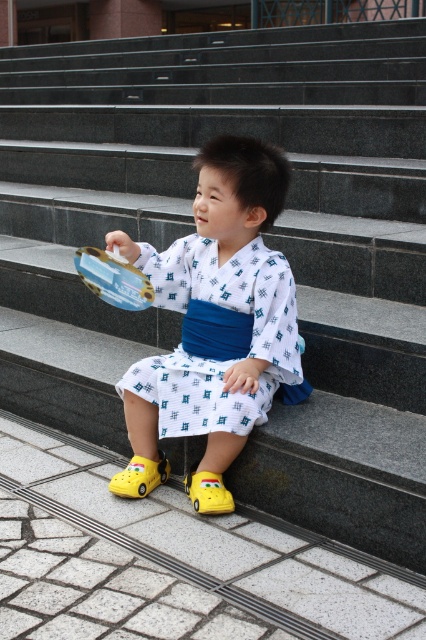
Question: Which of these objects is positioned closest to the metallic plastic toy car at center?

Choices:
 (A) yellow rubber shoe at lower left
 (B) white printed kimono at center
 (C) yellow rubber shoe at lower center

Answer: (B)

Question: Does white printed kimono at center have a larger size compared to metallic plastic toy car at center?

Choices:
 (A) no
 (B) yes

Answer: (B)

Question: Based on their relative distances, which object is farther from the yellow rubber shoe at lower center?

Choices:
 (A) white printed kimono at center
 (B) yellow rubber shoe at lower left
 (C) metallic plastic toy car at center

Answer: (C)

Question: Observing the image, what is the correct spatial positioning of white printed kimono at center in reference to metallic plastic toy car at center?

Choices:
 (A) below
 (B) above

Answer: (A)

Question: Among these points, which one is nearest to the camera?

Choices:
 (A) (262, 264)
 (B) (78, 248)

Answer: (A)

Question: Does metallic plastic toy car at center appear over yellow rubber shoe at lower left?

Choices:
 (A) yes
 (B) no

Answer: (A)